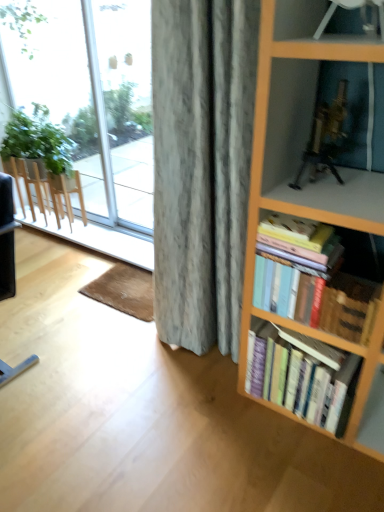
What are the coordinates of `vacant space that is in between hardcover books at right, the 1th book when ordered from bottom to top, and black leather chair at lower left` in the screenshot? It's located at (134, 373).